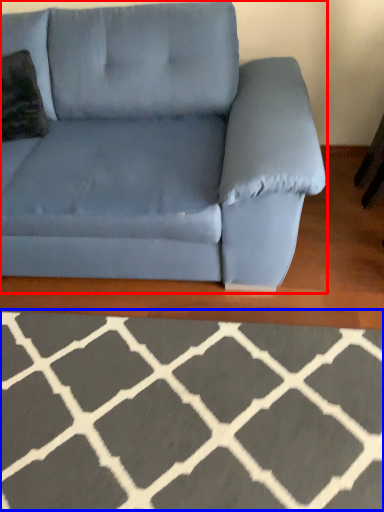
Question: Among these objects, which one is farthest to the camera, studio couch (highlighted by a red box) or furniture (highlighted by a blue box)?

Choices:
 (A) studio couch
 (B) furniture

Answer: (A)